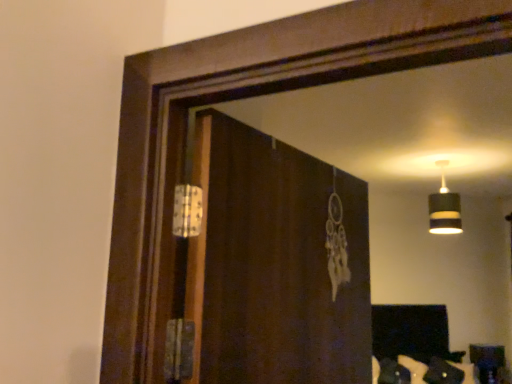
You are a GUI agent. You are given a task and a screenshot of the screen. Output one action in this format:
    pyautogui.click(x=<x>, y=<y>)
    Task: Click on the empty space that is ontop of black striped lampshade at upper right (from a real-world perspective)
    The height and width of the screenshot is (384, 512).
    Given the screenshot: What is the action you would take?
    pyautogui.click(x=445, y=162)